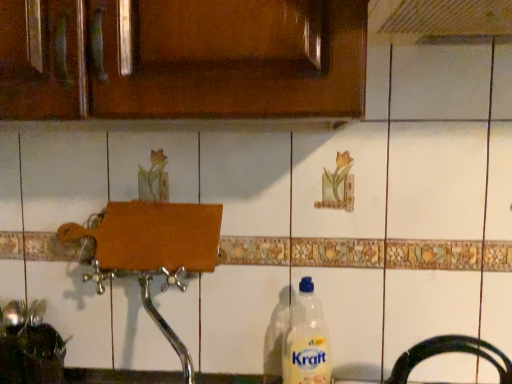
Question: Considering the relative sizes of translucent plastic bottle at lower center and brown wood cabinet at upper center in the image provided, is translucent plastic bottle at lower center thinner than brown wood cabinet at upper center?

Choices:
 (A) no
 (B) yes

Answer: (B)

Question: From a real-world perspective, does translucent plastic bottle at lower center stand above brown wood cabinet at upper center?

Choices:
 (A) no
 (B) yes

Answer: (A)

Question: Is there a large distance between translucent plastic bottle at lower center and brown wood cabinet at upper center?

Choices:
 (A) no
 (B) yes

Answer: (A)

Question: Is translucent plastic bottle at lower center aimed at brown wood cabinet at upper center?

Choices:
 (A) no
 (B) yes

Answer: (A)

Question: Does translucent plastic bottle at lower center contain brown wood cabinet at upper center?

Choices:
 (A) yes
 (B) no

Answer: (B)

Question: Can you confirm if translucent plastic bottle at lower center is positioned to the left of brown wood cabinet at upper center?

Choices:
 (A) no
 (B) yes

Answer: (A)

Question: Is brown wood cabinet at upper center beside translucent plastic bottle at lower center?

Choices:
 (A) yes
 (B) no

Answer: (B)

Question: Is brown wood cabinet at upper center facing towards translucent plastic bottle at lower center?

Choices:
 (A) yes
 (B) no

Answer: (B)

Question: Does brown wood cabinet at upper center lie behind translucent plastic bottle at lower center?

Choices:
 (A) no
 (B) yes

Answer: (A)

Question: Is the depth of brown wood cabinet at upper center less than that of translucent plastic bottle at lower center?

Choices:
 (A) yes
 (B) no

Answer: (A)

Question: Is brown wood cabinet at upper center at the left side of translucent plastic bottle at lower center?

Choices:
 (A) no
 (B) yes

Answer: (B)

Question: Is translucent plastic bottle at lower center at the back of brown wood cabinet at upper center?

Choices:
 (A) yes
 (B) no

Answer: (B)

Question: Based on their sizes in the image, would you say brown wood cabinet at upper center is bigger or smaller than translucent plastic bottle at lower center?

Choices:
 (A) small
 (B) big

Answer: (B)